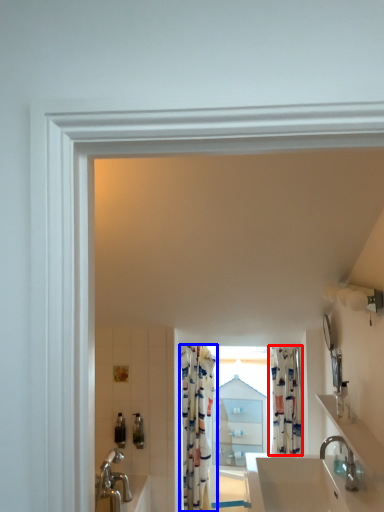
Question: Among these objects, which one is nearest to the camera, shower curtain (highlighted by a red box) or shower curtain (highlighted by a blue box)?

Choices:
 (A) shower curtain
 (B) shower curtain

Answer: (A)